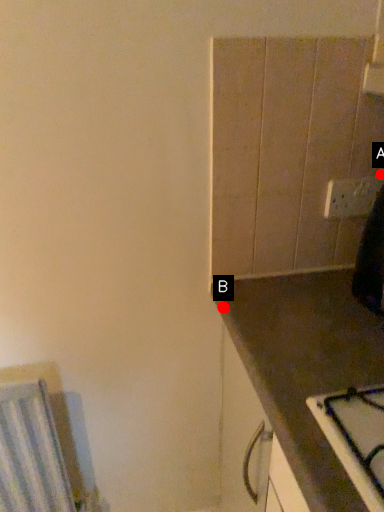
Question: Two points are circled on the image, labeled by A and B beside each circle. Which point is closer to the camera?

Choices:
 (A) A is closer
 (B) B is closer

Answer: (B)